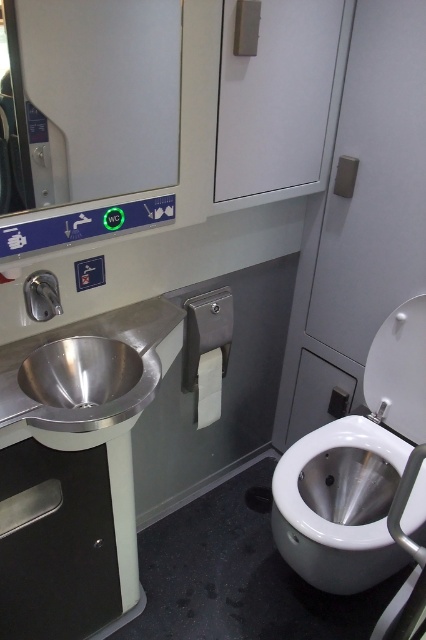
Question: Which object appears closest to the camera in this image?

Choices:
 (A) polished stainless steel sink at left
 (B) white glossy toilet bowl at lower right

Answer: (A)

Question: Which point is closer to the camera?

Choices:
 (A) (322, 556)
 (B) (108, 348)

Answer: (B)

Question: Is white glossy toilet bowl at lower right smaller than polished stainless steel sink at left?

Choices:
 (A) no
 (B) yes

Answer: (A)

Question: Is white glossy toilet bowl at lower right smaller than polished stainless steel sink at left?

Choices:
 (A) no
 (B) yes

Answer: (A)

Question: Which of the following is the farthest from the observer?

Choices:
 (A) (58, 355)
 (B) (328, 573)

Answer: (B)

Question: Where is white glossy toilet bowl at lower right located in relation to polished stainless steel sink at left in the image?

Choices:
 (A) left
 (B) right

Answer: (B)